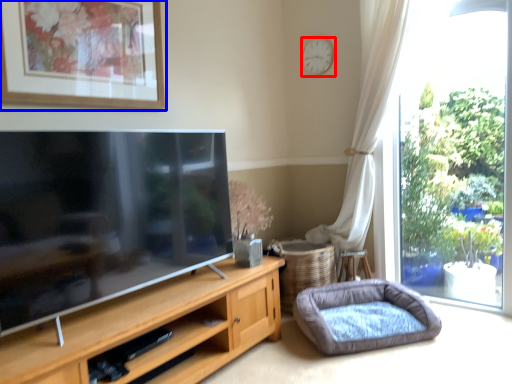
Question: Which object appears farthest to the camera in this image, clock (highlighted by a red box) or picture frame (highlighted by a blue box)?

Choices:
 (A) clock
 (B) picture frame

Answer: (A)